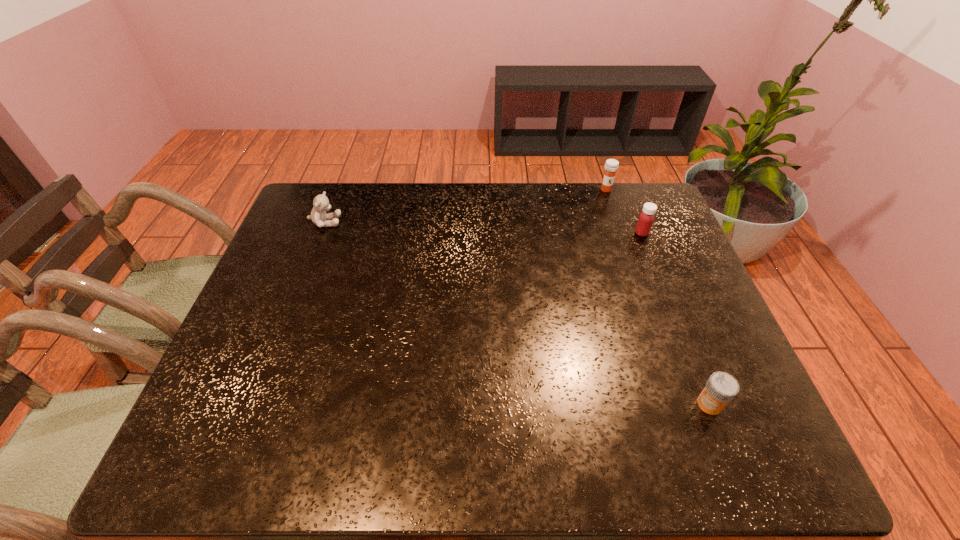
Where is `the farthest medicine`? This screenshot has width=960, height=540. the farthest medicine is located at coordinates (611, 166).

Find the location of a particular element. the leftmost medicine is located at coordinates (611, 166).

I want to click on the leftmost object, so click(321, 204).

Identify the location of the second farthest medicine. The height and width of the screenshot is (540, 960). (646, 218).

In order to click on the nearest object in this screenshot , I will do `click(721, 387)`.

The width and height of the screenshot is (960, 540). Find the location of `the nearest medicine`. the nearest medicine is located at coordinates (721, 387).

Where is `vacant space located on the label side of the leftmost medicine`? The width and height of the screenshot is (960, 540). vacant space located on the label side of the leftmost medicine is located at coordinates (612, 206).

At what (x,y) coordinates should I click in order to perform the action: click on vacant space situated on the face of the teddy bear. Please return your answer as a coordinate pair (x, y). The height and width of the screenshot is (540, 960). Looking at the image, I should click on (364, 222).

Identify the location of vacant space located 0.090m on the back of the second nearest medicine. Image resolution: width=960 pixels, height=540 pixels. (633, 211).

Locate an element on the screen. The width and height of the screenshot is (960, 540). free space located on the label side of the nearest object is located at coordinates (664, 404).